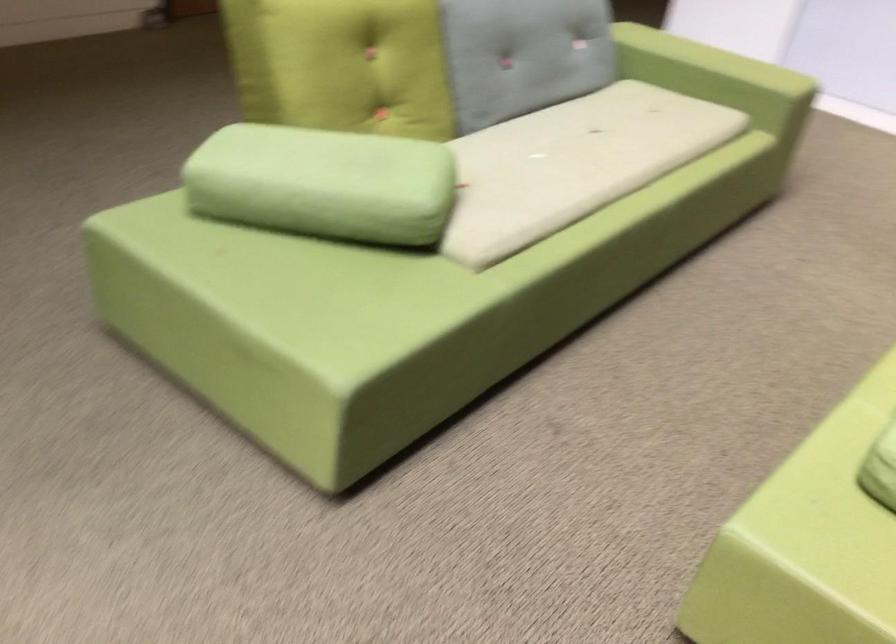
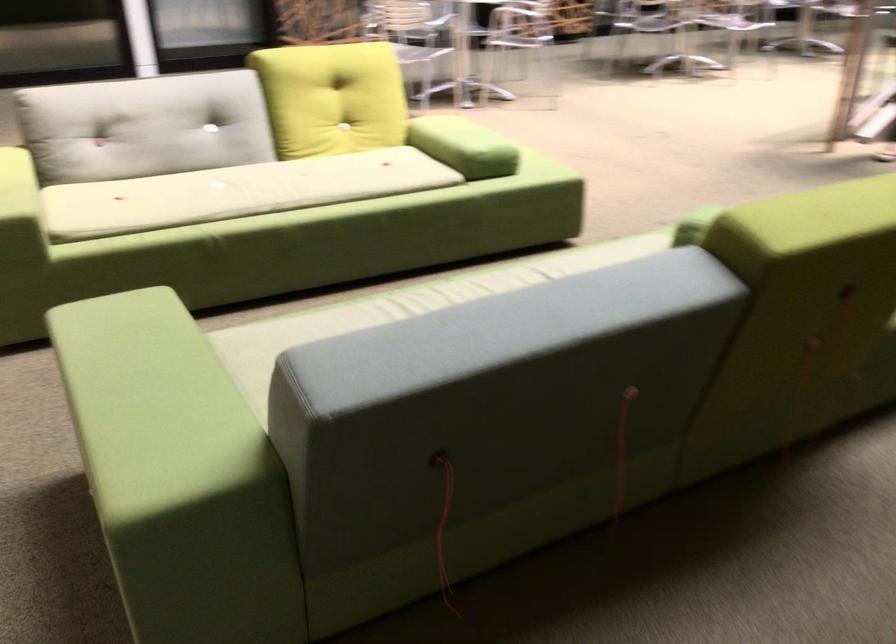
Question: I am providing you with two images of the same scene from different viewpoints. After the viewpoint changes to image2, which objects are now occluded?

Choices:
 (A) sofa sitting surface
 (B) silver electric guitar
 (C) green bolster pillow
 (D) sofa armrest

Answer: (C)